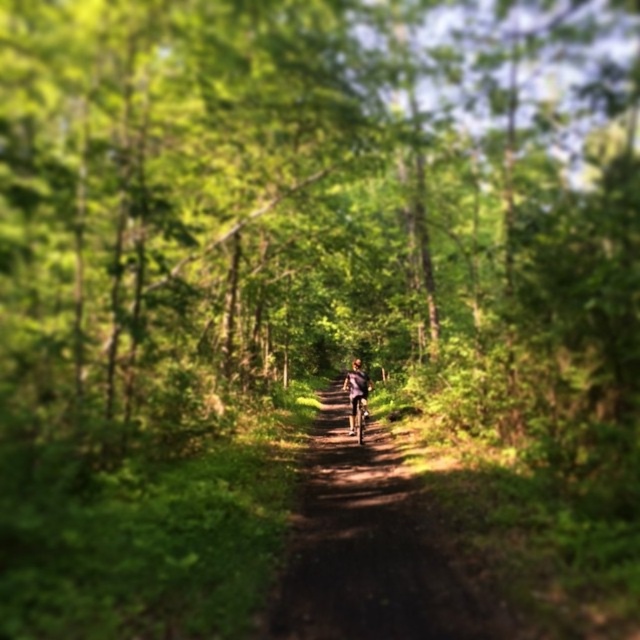
You are standing on the forest trail and want to reach a point that is 22.01 feet away from you. Can you determine if the point you want to reach is the point marked at coordinates point (x=378, y=560)?

Yes, the point marked at coordinates point (x=378, y=560) is exactly 22.01 feet away from the viewer, so it is the point you want to reach.

You are planning to ride a bicycle through the forest trail. You see the dirt path at center and the shiny metallic bicycle at center. Which one has a larger area in the image?

The dirt path at center is bigger than the shiny metallic bicycle at center, so the dirt path at center has a larger area in the image.

You are a hiker on the forest trail and see the matte purple jacket at center and the shiny metallic bicycle at center. Which object is positioned higher relative to the other?

The matte purple jacket at center is above the shiny metallic bicycle at center, so it is positioned higher.